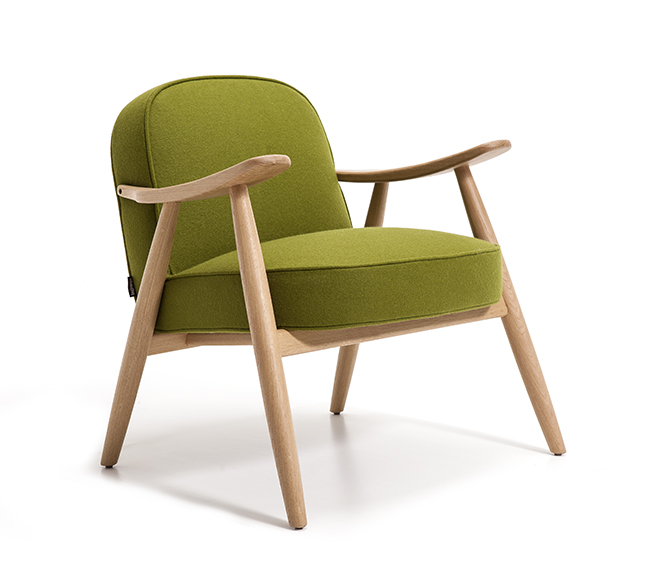
Find the location of a particular element. The image size is (648, 576). backrest is located at coordinates (212, 157).